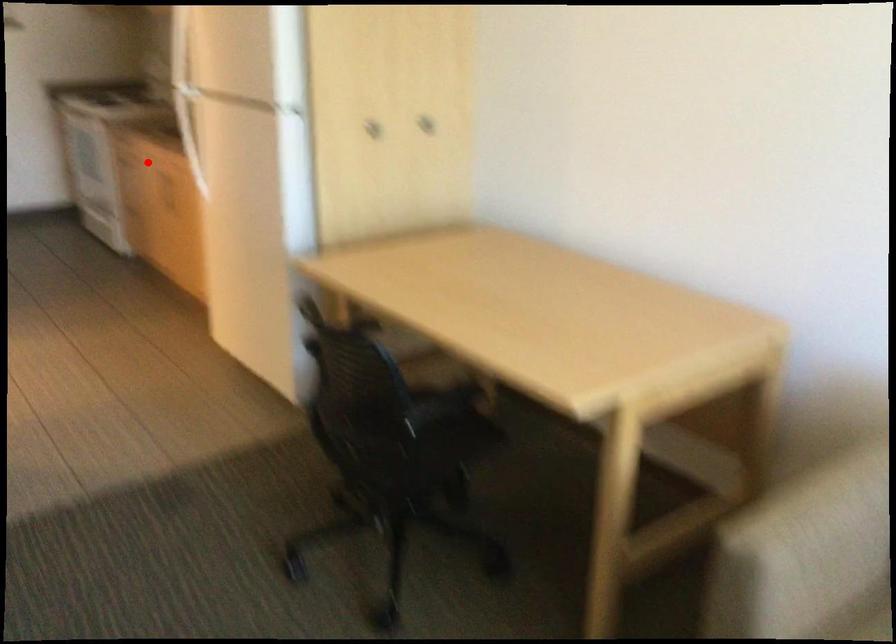
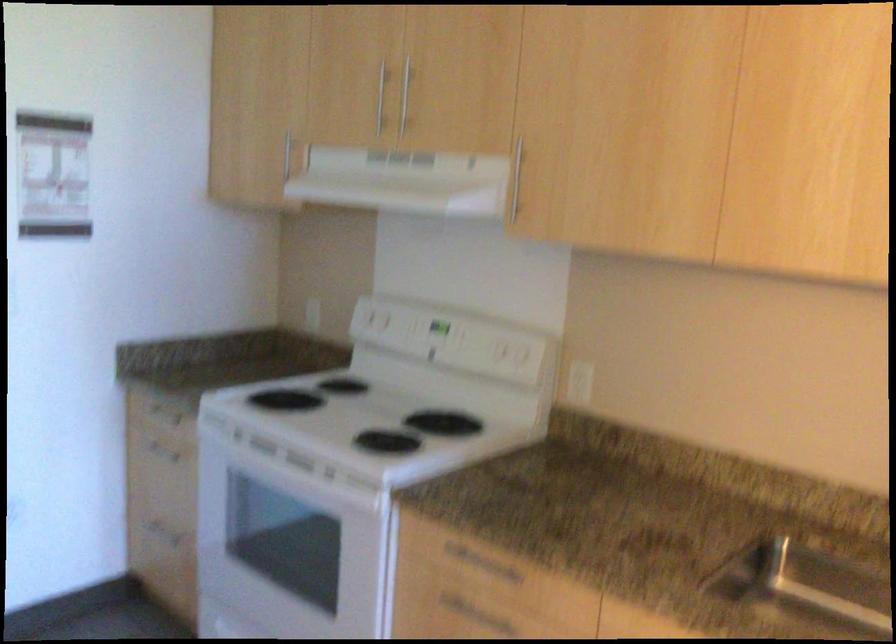
Question: I am providing you with two images of the same scene from different viewpoints. Image1 has a red point marked. In image2, the corresponding 3D location appears at what relative position? Reply with the corresponding letter.

Choices:
 (A) Closer
 (B) Farther

Answer: (A)